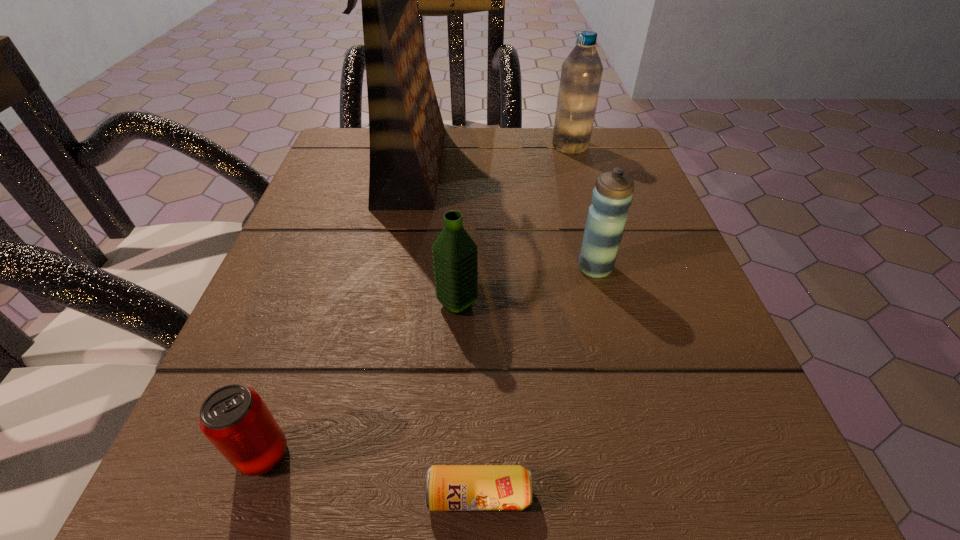
Image resolution: width=960 pixels, height=540 pixels. I want to click on object that is at the far left corner, so click(x=406, y=130).

You are a GUI agent. You are given a task and a screenshot of the screen. Output one action in this format:
    pyautogui.click(x=<x>, y=<y>)
    Task: Click on the object situated at the near left corner
    
    Given the screenshot: What is the action you would take?
    pyautogui.click(x=235, y=419)

At what (x,y) coordinates should I click in order to perform the action: click on object at the far right corner. Please return your answer as a coordinate pair (x, y). Looking at the image, I should click on (581, 72).

In the image, there is a desktop. At what (x,y) coordinates should I click in order to perform the action: click on free space at the far edge. Please return your answer as a coordinate pair (x, y). Looking at the image, I should click on (501, 161).

Image resolution: width=960 pixels, height=540 pixels. I want to click on vacant space at the left edge of the desktop, so click(341, 197).

This screenshot has width=960, height=540. In the image, there is a desktop. In order to click on free space at the right edge in this screenshot , I will do `click(705, 394)`.

Where is `free space at the far left corner`? Image resolution: width=960 pixels, height=540 pixels. free space at the far left corner is located at coordinates (367, 127).

The height and width of the screenshot is (540, 960). What are the coordinates of `free space between the farthest water bottle and the nearest water bottle` in the screenshot? It's located at (514, 225).

Image resolution: width=960 pixels, height=540 pixels. I want to click on empty space between the shopping bag and the farthest water bottle, so click(492, 155).

The height and width of the screenshot is (540, 960). Find the location of `vacant area that lies between the fourth nearest object and the fifth shortest object`. vacant area that lies between the fourth nearest object and the fifth shortest object is located at coordinates (583, 207).